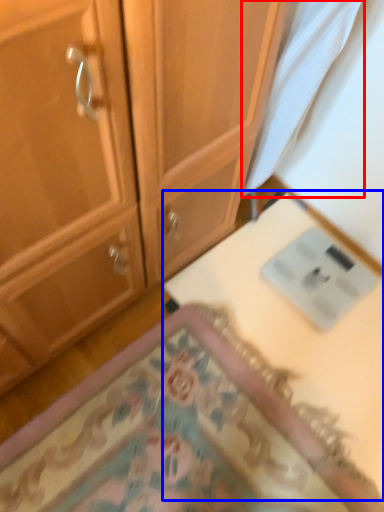
Question: Which point is closer to the camera, fabric (highlighted by a red box) or table (highlighted by a blue box)?

Choices:
 (A) fabric
 (B) table

Answer: (A)